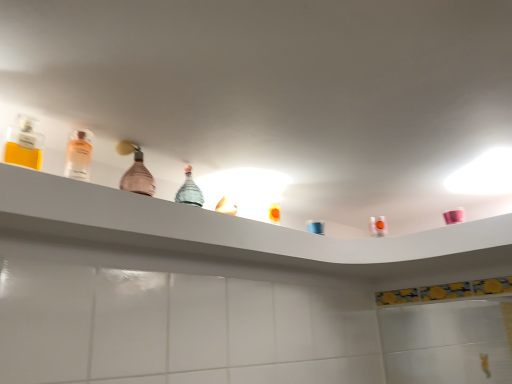
Question: Is clear glass perfume at upper left, the 3th bottle in the right-to-left sequence, wider than clear glass bottle at left, acting as the second bottle starting from the right?

Choices:
 (A) no
 (B) yes

Answer: (A)

Question: From a real-world perspective, is clear glass perfume at upper left, the 3th bottle in the right-to-left sequence, over clear glass bottle at left, placed as the second bottle when sorted from left to right?

Choices:
 (A) yes
 (B) no

Answer: (B)

Question: Does clear glass perfume at upper left, the 3th bottle positioned from the back, have a greater height compared to clear glass bottle at left, the 2th bottle when ordered from front to back?

Choices:
 (A) no
 (B) yes

Answer: (A)

Question: Is clear glass perfume at upper left, positioned as the 1th bottle in left-to-right order, facing towards clear glass bottle at left, placed as the second bottle when sorted from left to right?

Choices:
 (A) no
 (B) yes

Answer: (A)

Question: From the image's perspective, is clear glass perfume at upper left, the 3th bottle positioned from the back, located beneath clear glass bottle at left, the second bottle from the back?

Choices:
 (A) no
 (B) yes

Answer: (A)

Question: Is clear glass perfume at upper left, which appears as the 1th bottle when viewed from the front, behind clear glass bottle at left, the second bottle from the back?

Choices:
 (A) no
 (B) yes

Answer: (A)

Question: Can you confirm if clear glass bottle at left, the 2th bottle when ordered from front to back, is taller than translucent plastic mouthwash at upper right?

Choices:
 (A) no
 (B) yes

Answer: (B)

Question: Is clear glass bottle at left, the second bottle from the back, to the left of translucent plastic mouthwash at upper right from the viewer's perspective?

Choices:
 (A) no
 (B) yes

Answer: (B)

Question: From a real-world perspective, is clear glass bottle at left, acting as the second bottle starting from the right, below translucent plastic mouthwash at upper right?

Choices:
 (A) yes
 (B) no

Answer: (B)

Question: Could you tell me if clear glass bottle at left, the 2th bottle when ordered from front to back, is turned towards translucent plastic mouthwash at upper right?

Choices:
 (A) yes
 (B) no

Answer: (B)

Question: Is clear glass bottle at left, acting as the second bottle starting from the right, behind translucent plastic mouthwash at upper right?

Choices:
 (A) yes
 (B) no

Answer: (B)

Question: Is there a large distance between clear glass bottle at left, placed as the second bottle when sorted from left to right, and translucent plastic mouthwash at upper right?

Choices:
 (A) no
 (B) yes

Answer: (B)

Question: From a real-world perspective, is pink glass bottle at center, which appears as the 3th bottle when viewed from the left, located higher than clear glass perfume at upper left, the 3th bottle in the right-to-left sequence?

Choices:
 (A) yes
 (B) no

Answer: (A)